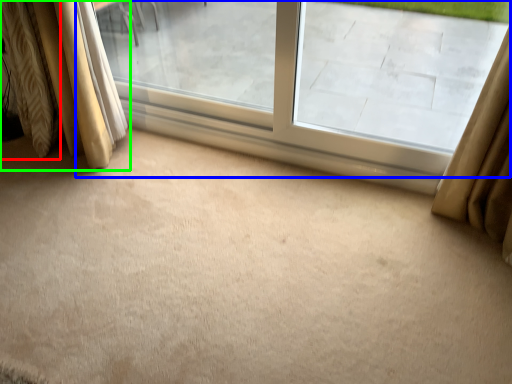
Question: Which object is the farthest from curtain (highlighted by a red box)? Choose among these: window (highlighted by a blue box) or curtain (highlighted by a green box).

Choices:
 (A) window
 (B) curtain

Answer: (A)